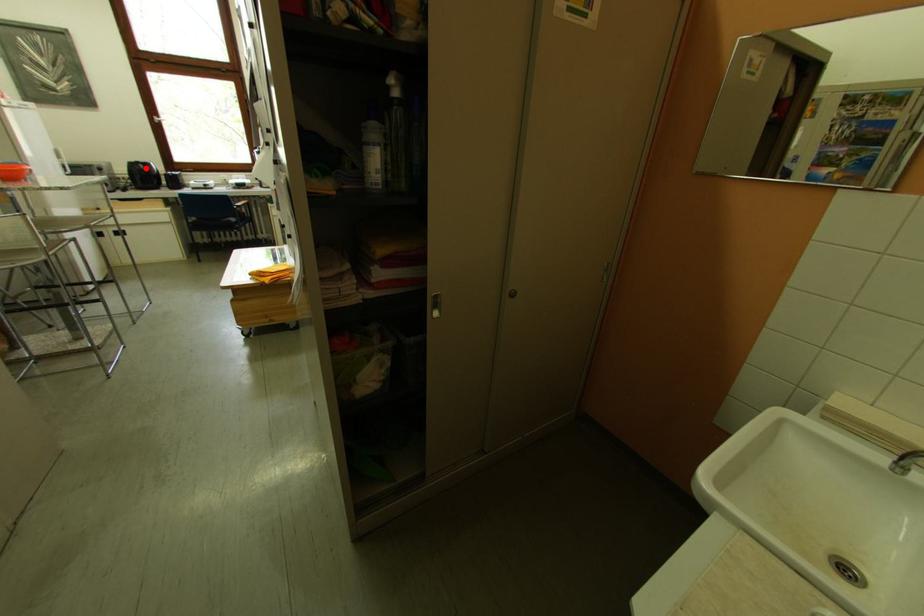
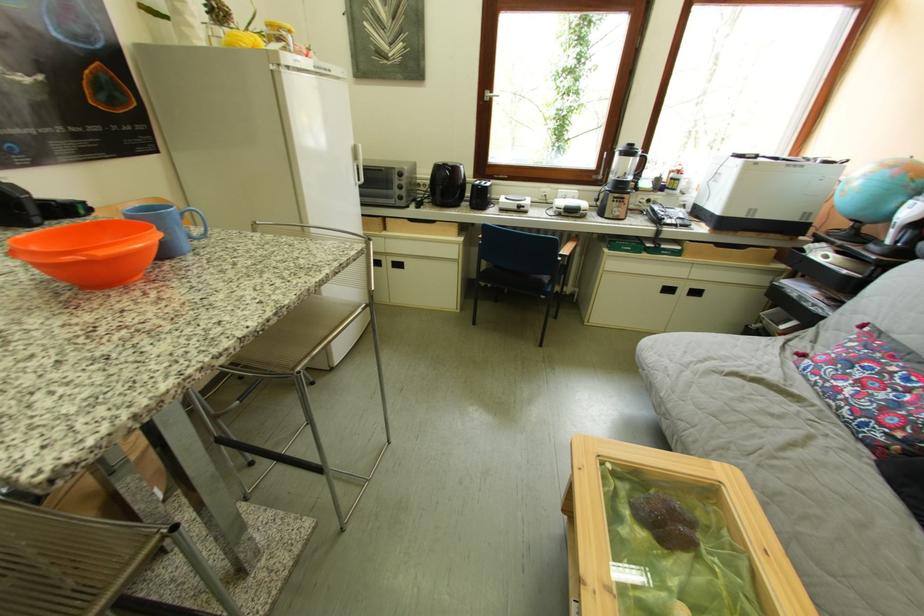
Where in the second image is the point corresponding to the highlighted location from the first image?

(451, 171)